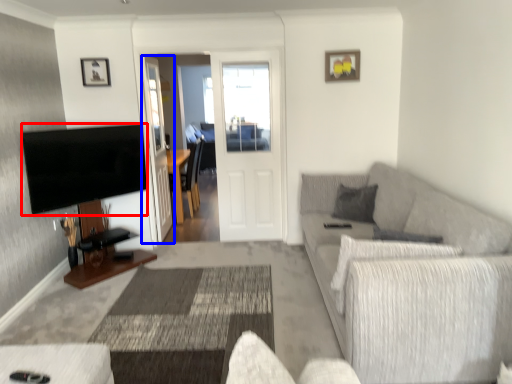
Question: Which of the following is the closest to the observer, television (highlighted by a red box) or glass door (highlighted by a blue box)?

Choices:
 (A) television
 (B) glass door

Answer: (A)